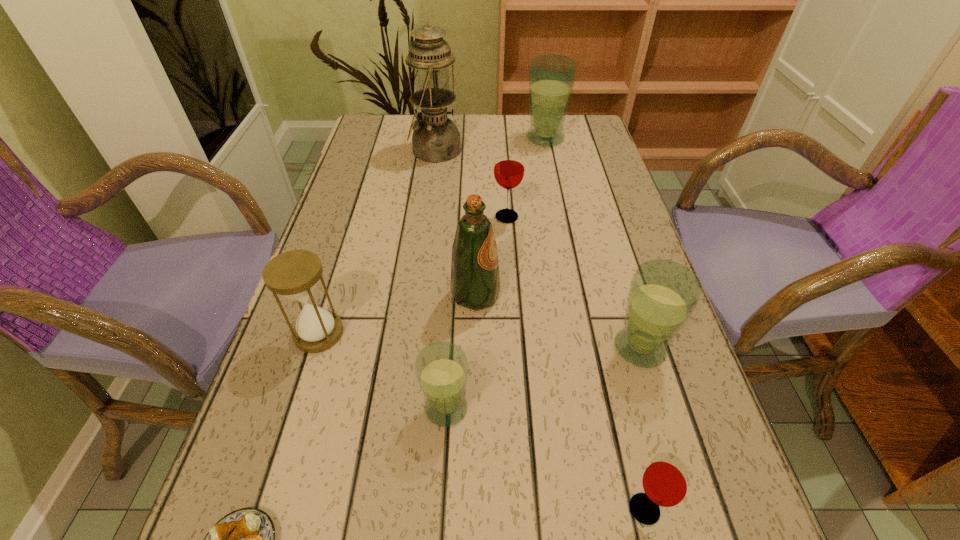
What are the coordinates of `free space located on the right of the second nearest glass` in the screenshot? It's located at (705, 408).

Locate an element on the screen. This screenshot has height=540, width=960. vacant space located on the back of the right red glass is located at coordinates click(x=600, y=322).

Locate an element on the screen. Image resolution: width=960 pixels, height=540 pixels. oil lamp that is at the far edge is located at coordinates (436, 138).

Image resolution: width=960 pixels, height=540 pixels. I want to click on glass present at the far edge, so click(x=551, y=77).

At what (x,y) coordinates should I click in order to perform the action: click on oil lamp positioned at the left edge. Please return your answer as a coordinate pair (x, y). The image size is (960, 540). Looking at the image, I should click on (436, 138).

The image size is (960, 540). I want to click on hourglass that is at the left edge, so click(294, 274).

Image resolution: width=960 pixels, height=540 pixels. Identify the location of object located at the far left corner. (436, 138).

Where is `object present at the far right corner`? object present at the far right corner is located at coordinates pos(551,77).

At what (x,y) coordinates should I click in order to perform the action: click on vacant space at the far edge of the desktop. Please return your answer as a coordinate pair (x, y). The image size is (960, 540). Looking at the image, I should click on (486, 143).

At what (x,y) coordinates should I click in order to perform the action: click on vacant space at the left edge of the desktop. Please return your answer as a coordinate pair (x, y). This screenshot has height=540, width=960. Looking at the image, I should click on (395, 160).